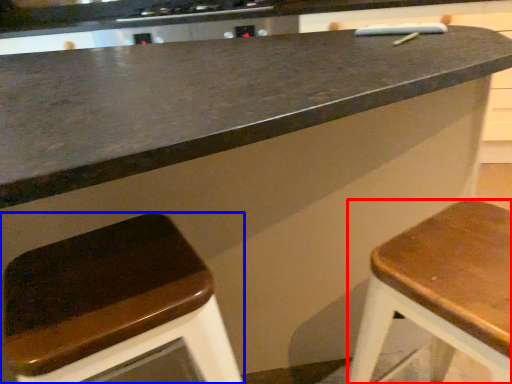
Question: Which point is closer to the camera, stool (highlighted by a red box) or stool (highlighted by a blue box)?

Choices:
 (A) stool
 (B) stool

Answer: (A)